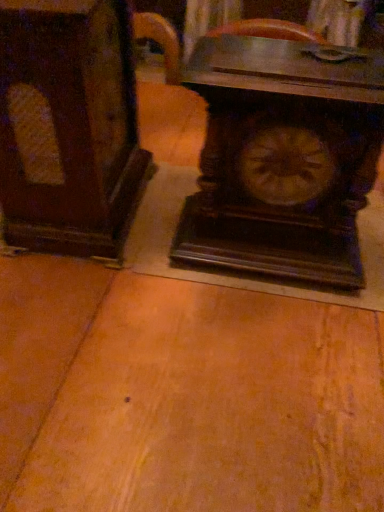
Question: Is wooden carved clock at center bigger than dark wood table at center?

Choices:
 (A) no
 (B) yes

Answer: (A)

Question: From the image's perspective, is wooden carved clock at center beneath dark wood table at center?

Choices:
 (A) yes
 (B) no

Answer: (B)

Question: Does wooden carved clock at center have a greater width compared to dark wood table at center?

Choices:
 (A) yes
 (B) no

Answer: (B)

Question: Does wooden carved clock at center have a lesser height compared to dark wood table at center?

Choices:
 (A) yes
 (B) no

Answer: (A)

Question: Is wooden carved clock at center positioned with its back to dark wood table at center?

Choices:
 (A) no
 (B) yes

Answer: (A)

Question: From the image's perspective, is wooden carved clock at center on top of dark wood table at center?

Choices:
 (A) no
 (B) yes

Answer: (B)

Question: Can you confirm if dark wood table at center is taller than dark wood cabinet at left?

Choices:
 (A) yes
 (B) no

Answer: (A)

Question: From a real-world perspective, is dark wood table at center physically above dark wood cabinet at left?

Choices:
 (A) yes
 (B) no

Answer: (B)

Question: Is dark wood table at center outside dark wood cabinet at left?

Choices:
 (A) yes
 (B) no

Answer: (A)

Question: Is dark wood table at center behind dark wood cabinet at left?

Choices:
 (A) no
 (B) yes

Answer: (A)

Question: Are dark wood table at center and dark wood cabinet at left beside each other?

Choices:
 (A) yes
 (B) no

Answer: (B)

Question: Can you confirm if dark wood table at center is wider than dark wood cabinet at left?

Choices:
 (A) yes
 (B) no

Answer: (A)

Question: Is dark wood cabinet at left positioned beyond the bounds of dark wood table at center?

Choices:
 (A) yes
 (B) no

Answer: (A)